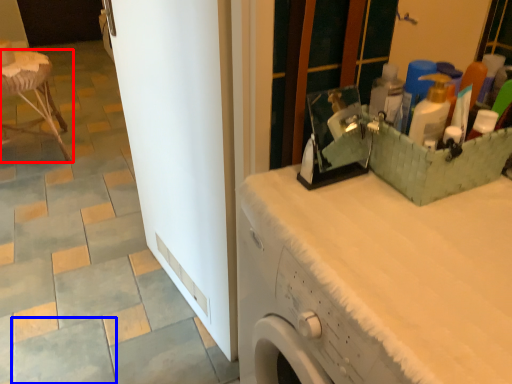
Question: Which object is further to the camera taking this photo, furniture (highlighted by a red box) or ceramic tile (highlighted by a blue box)?

Choices:
 (A) furniture
 (B) ceramic tile

Answer: (A)